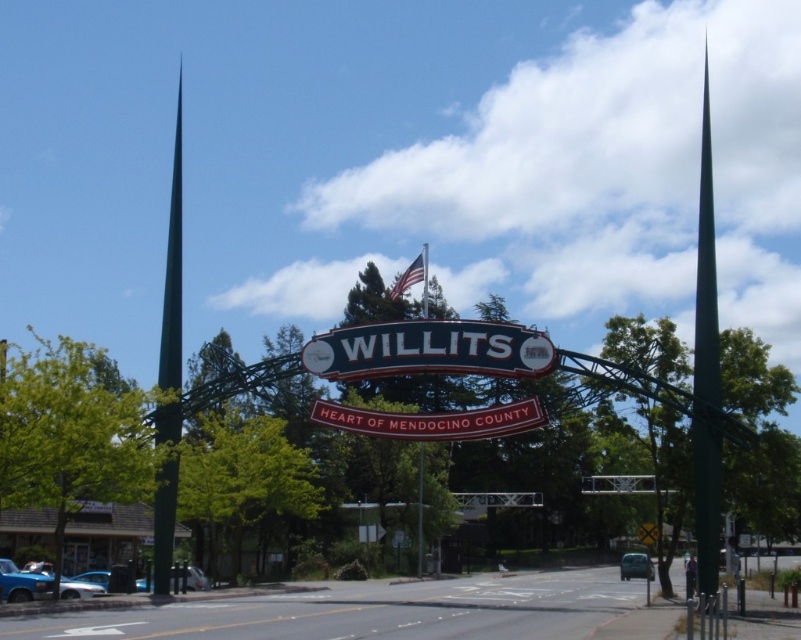
Question: Considering the real-world distances, which object is closest to the green metallic spire at right?

Choices:
 (A) green metallic spire at left
 (B) metallic blue sign at center

Answer: (B)

Question: Which object appears closest to the camera in this image?

Choices:
 (A) green metallic spire at left
 (B) green metallic spire at right
 (C) metallic blue sign at center
 (D) red matte sign at center

Answer: (B)

Question: Can you confirm if metallic blue sign at center is wider than red matte sign at center?

Choices:
 (A) yes
 (B) no

Answer: (A)

Question: Is metallic blue sign at center to the right of red matte sign at center from the viewer's perspective?

Choices:
 (A) yes
 (B) no

Answer: (B)

Question: Which point is closer to the camera taking this photo?

Choices:
 (A) (339, 413)
 (B) (312, 340)
 (C) (155, 499)

Answer: (A)

Question: Does metallic blue sign at center have a greater width compared to red matte sign at center?

Choices:
 (A) yes
 (B) no

Answer: (A)